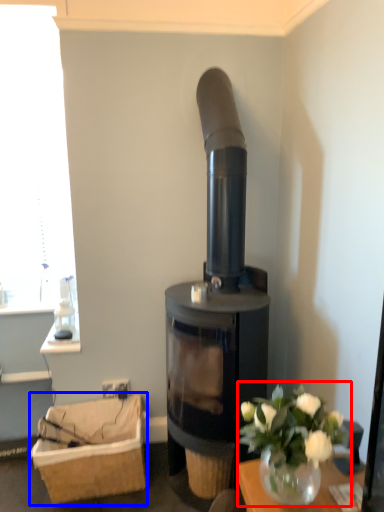
Question: Which object appears farthest to the camera in this image, floral arrangement (highlighted by a red box) or basket (highlighted by a blue box)?

Choices:
 (A) floral arrangement
 (B) basket

Answer: (B)